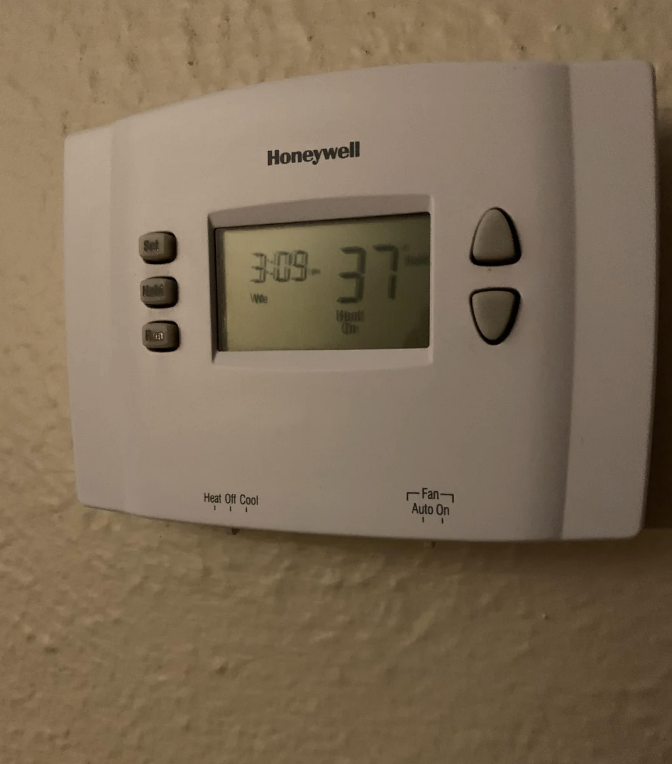
Find the location of a particular element. This screenshot has width=672, height=764. display screen is located at coordinates (285, 309).